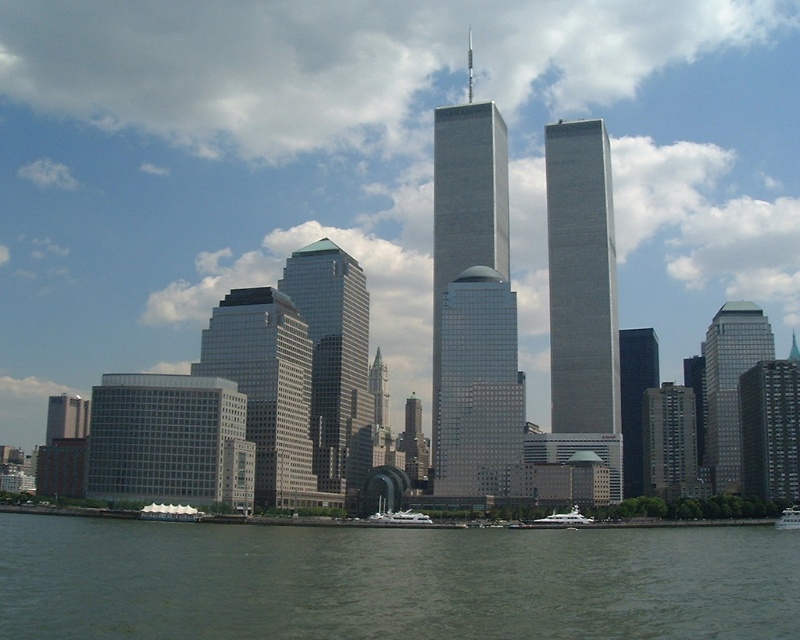
Question: Does gray concrete skyscraper at center have a lesser width compared to glassy silver skyscraper at right?

Choices:
 (A) no
 (B) yes

Answer: (B)

Question: Can you confirm if matte glass skyscraper at center-left is positioned above matte glass skyscraper at center?

Choices:
 (A) no
 (B) yes

Answer: (A)

Question: Considering the relative positions of matte glass skyscraper at center and glassy silver skyscraper at right in the image provided, where is matte glass skyscraper at center located with respect to glassy silver skyscraper at right?

Choices:
 (A) above
 (B) below

Answer: (B)

Question: Considering the real-world distances, which object is closest to the gray glass building at center?

Choices:
 (A) white glossy yacht at lower center
 (B) green glass skyscraper at center

Answer: (A)

Question: Which point appears farthest from the camera in this image?

Choices:
 (A) (512, 298)
 (B) (566, 164)

Answer: (B)

Question: Which point is farther to the camera?

Choices:
 (A) (374, 388)
 (B) (304, 298)
 (C) (296, 321)

Answer: (A)